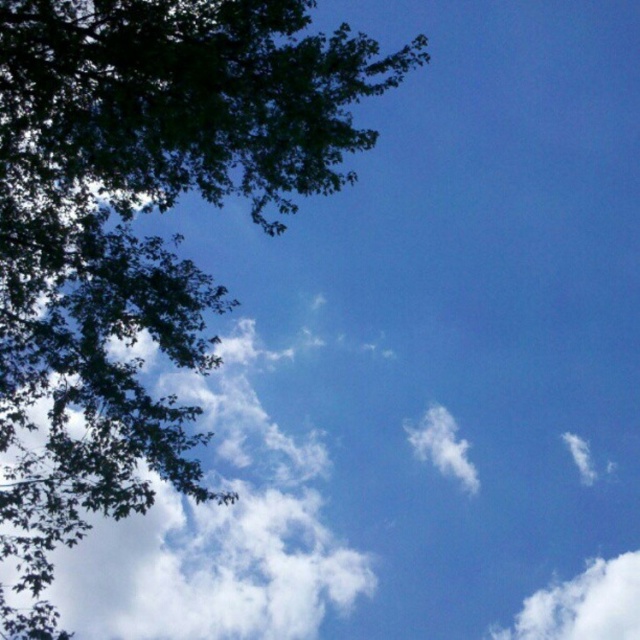
Who is shorter, white fluffy cloud at upper left or white fluffy cloud at center?

With less height is white fluffy cloud at upper left.

Does point (141, 518) come behind point (438, 436)?

No.

I want to click on white fluffy cloud at upper left, so click(218, 532).

Is point (72, 337) closer to camera compared to point (218, 419)?

That is True.

In the scene shown: Is green leafy tree at upper left taller than white fluffy cloud at upper left?

Yes, green leafy tree at upper left is taller than white fluffy cloud at upper left.

Is point (221, 61) behind point (264, 628)?

No.

Where is `green leafy tree at upper left`? The width and height of the screenshot is (640, 640). green leafy tree at upper left is located at coordinates (132, 230).

Is white fluffy cloud at lower right thinner than white fluffy cloud at center?

No.

Is white fluffy cloud at lower right wider than white fluffy cloud at center?

Correct, the width of white fluffy cloud at lower right exceeds that of white fluffy cloud at center.

This screenshot has height=640, width=640. Identify the location of white fluffy cloud at lower right. (582, 604).

At what (x,y) coordinates should I click in order to perform the action: click on white fluffy cloud at lower right. Please return your answer as a coordinate pair (x, y). The height and width of the screenshot is (640, 640). Looking at the image, I should click on (582, 604).